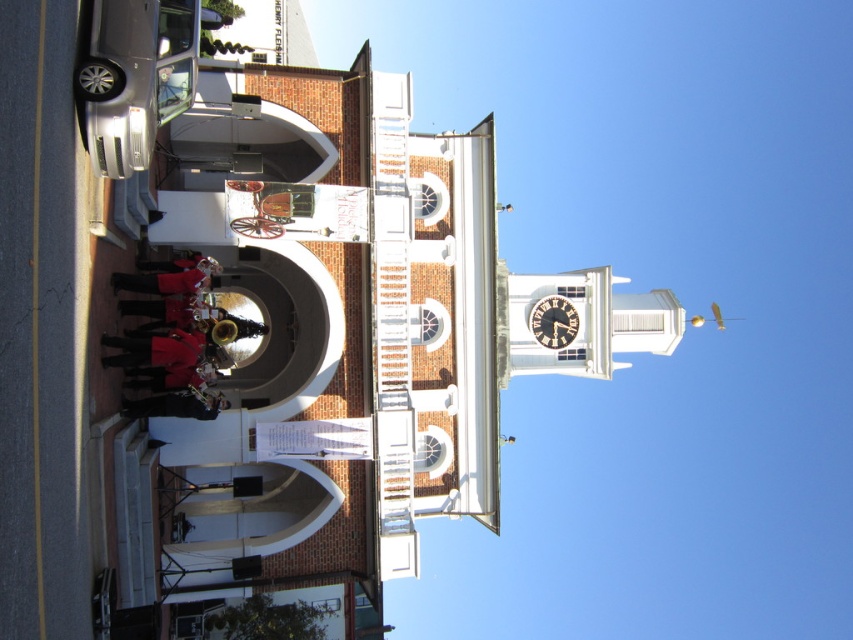
You are a photographer positioned in front of the historic building. You want to capture a photo that includes both the satin silver sedan at left and the wooden clock at upper center. Which object should you adjust your camera angle to include first if you need to frame them both?

The satin silver sedan at left is to the left of the wooden clock at upper center, so you should adjust your camera angle to include the satin silver sedan at left first, then ensure the wooden clock at upper center is also in frame.

Consider the image. You are standing in front of the historic building and want to determine which of the two points, point (111, 60) or point (537, 317), is closer to you. Based on the scene description, which point is nearer?

Point (111, 60) is closer to the viewer than point (537, 317).

You are driving a car and want to park it in the parking lot near the historic building. The parking spot is marked by a point at coordinates point (137, 76). Is there enough space for your car if the parking spot is only designed for compact cars?

The point (137, 76) indicates a satin silver sedan at left, which is a compact car. Therefore, the parking spot is suitable for your car if it is a compact car.